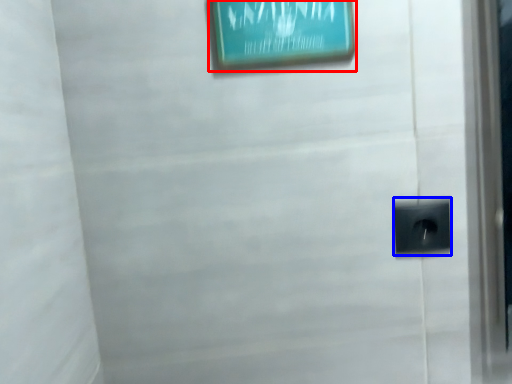
Question: Which of the following is the farthest to the observer, picture frame (highlighted by a red box) or electric outlet (highlighted by a blue box)?

Choices:
 (A) picture frame
 (B) electric outlet

Answer: (B)